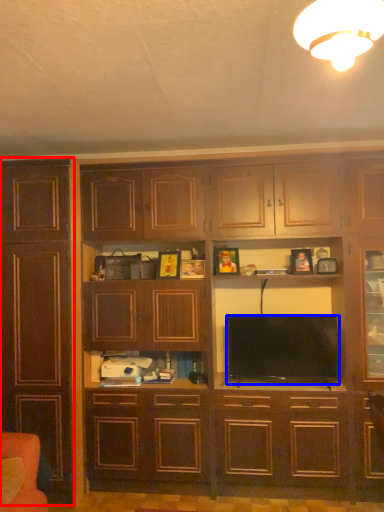
Question: Which point is further to the camera, cabinetry (highlighted by a red box) or television (highlighted by a blue box)?

Choices:
 (A) cabinetry
 (B) television

Answer: (B)